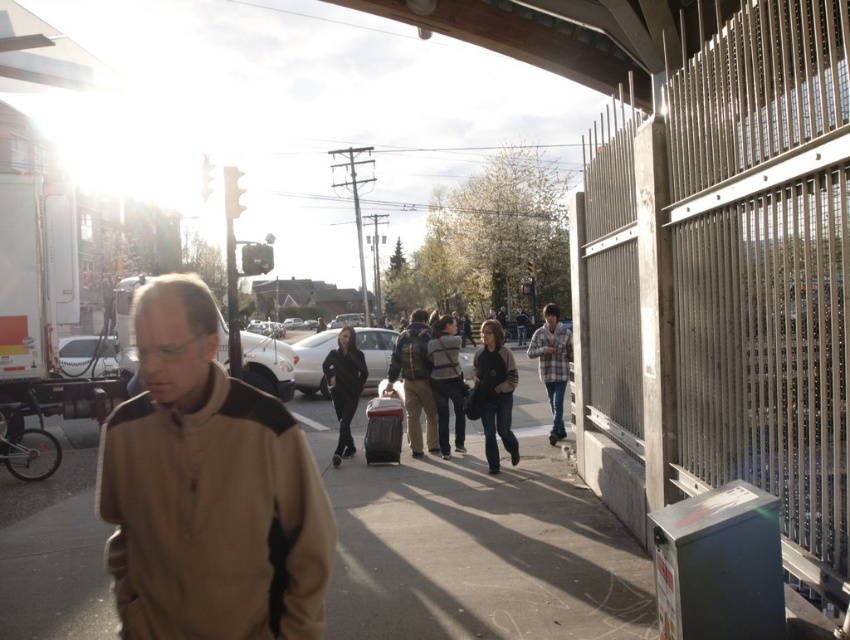
You are a fashion designer observing two jackets in an urban setting. The brown textured jacket at center and the black matte jacket at center are both in the same scene. Which jacket appears larger to you?

The black matte jacket at center appears larger because the brown textured jacket at center is smaller than it.

You are a fashion designer observing two jackets in a photo. The brown textured jacket at center and the black matte jacket at center. Which one is wider?

The brown textured jacket at center is wider than the black matte jacket at center according to the description.